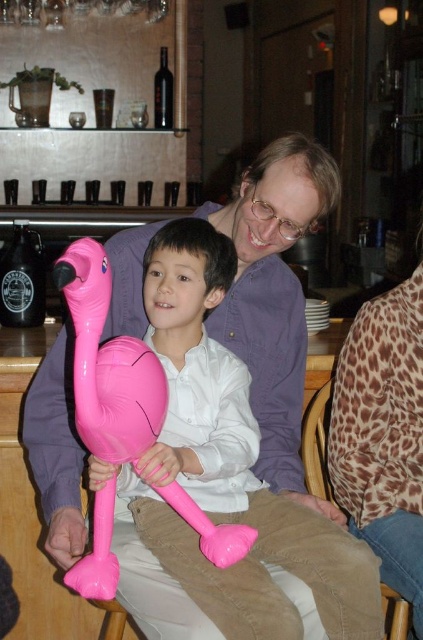
This screenshot has height=640, width=423. Describe the element at coordinates (384, 433) in the screenshot. I see `leopard print blouse at upper right` at that location.

Looking at this image, between leopard print blouse at upper right and leopard print fabric at lower right, which one has more height?

Standing taller between the two is leopard print blouse at upper right.

Locate an element on the screen. leopard print blouse at upper right is located at coordinates (384, 433).

Find the location of a particular element. leopard print blouse at upper right is located at coordinates (384, 433).

Is matte purple shirt at center above leopard print blouse at upper right?

Yes, matte purple shirt at center is above leopard print blouse at upper right.

Is point (60, 352) more distant than point (420, 317)?

No, (60, 352) is in front of (420, 317).

This screenshot has height=640, width=423. Find the location of `matte purple shirt at center`. matte purple shirt at center is located at coordinates (274, 296).

Between matte purple shirt at center and pink inflatable flamingo at center, which one is positioned higher?

matte purple shirt at center is above.

Can you confirm if matte purple shirt at center is bigger than pink inflatable flamingo at center?

Correct, matte purple shirt at center is larger in size than pink inflatable flamingo at center.

Locate an element on the screen. The image size is (423, 640). matte purple shirt at center is located at coordinates (274, 296).